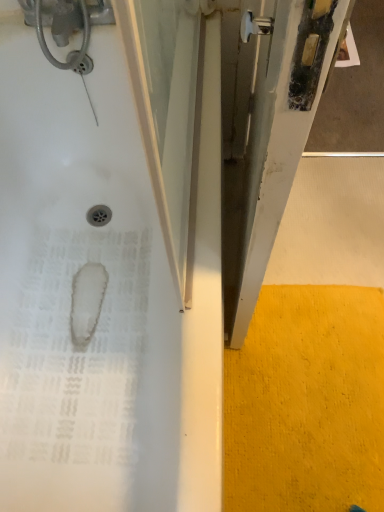
In order to click on blank area beneath yellow textured carpet at lower right (from a real-world perspective) in this screenshot , I will do `click(306, 396)`.